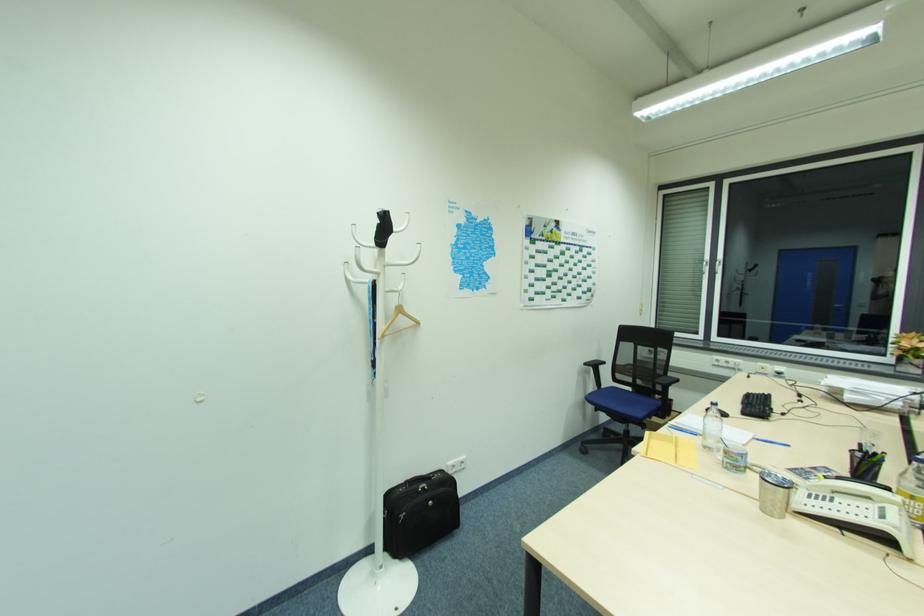
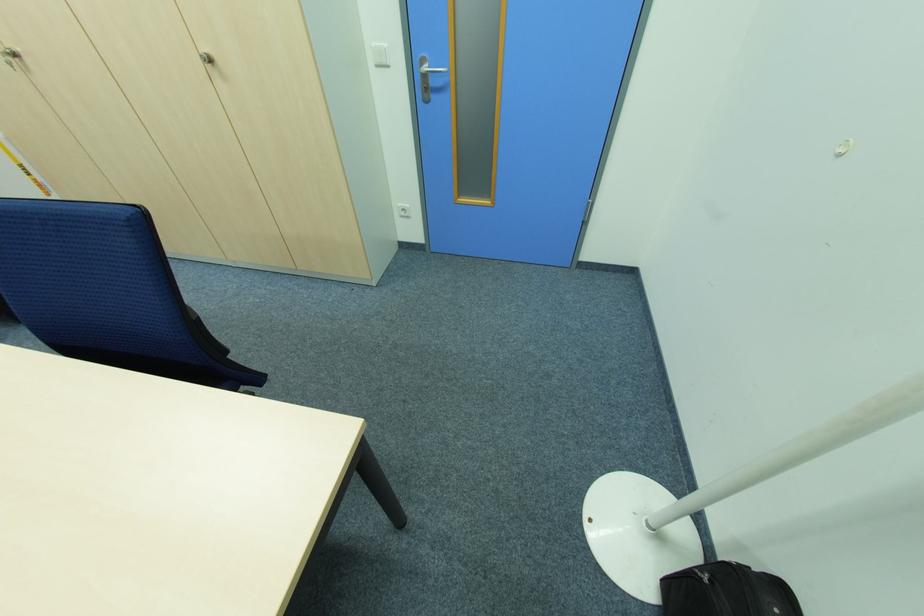
Find the pixel in the second image that matches [414,561] in the first image.

(662, 607)